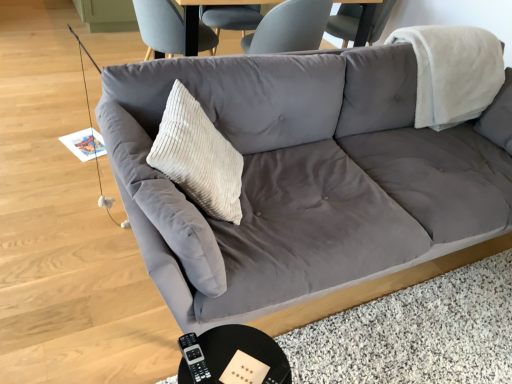
Question: Is suede gray couch at center oriented away from black glossy round table at lower center?

Choices:
 (A) yes
 (B) no

Answer: (B)

Question: Is black glossy round table at lower center surrounded by suede gray couch at center?

Choices:
 (A) yes
 (B) no

Answer: (B)

Question: Is suede gray couch at center not near black glossy round table at lower center?

Choices:
 (A) yes
 (B) no

Answer: (B)

Question: From the image's perspective, is suede gray couch at center above black glossy round table at lower center?

Choices:
 (A) no
 (B) yes

Answer: (B)

Question: From a real-world perspective, is suede gray couch at center on top of black glossy round table at lower center?

Choices:
 (A) no
 (B) yes

Answer: (B)

Question: In terms of size, does suede gray couch at center appear bigger or smaller than black glossy round table at lower center?

Choices:
 (A) small
 (B) big

Answer: (B)

Question: From the image's perspective, is suede gray couch at center above or below black glossy round table at lower center?

Choices:
 (A) below
 (B) above

Answer: (B)

Question: In terms of width, does suede gray couch at center look wider or thinner when compared to black glossy round table at lower center?

Choices:
 (A) thin
 (B) wide

Answer: (B)

Question: From a real-world perspective, relative to black glossy round table at lower center, is suede gray couch at center vertically above or below?

Choices:
 (A) below
 (B) above

Answer: (B)

Question: Looking at their shapes, would you say black glossy round table at lower center is wider or thinner than beige corduroy pillow at center?

Choices:
 (A) wide
 (B) thin

Answer: (A)

Question: From a real-world perspective, is black glossy round table at lower center positioned above or below beige corduroy pillow at center?

Choices:
 (A) below
 (B) above

Answer: (A)

Question: Does point (183, 336) appear closer or farther from the camera than point (186, 155)?

Choices:
 (A) closer
 (B) farther

Answer: (A)

Question: In terms of size, does black glossy round table at lower center appear bigger or smaller than beige corduroy pillow at center?

Choices:
 (A) small
 (B) big

Answer: (A)

Question: From their relative heights in the image, would you say black glossy round table at lower center is taller or shorter than suede gray couch at center?

Choices:
 (A) tall
 (B) short

Answer: (B)

Question: Is black glossy round table at lower center in front of or behind suede gray couch at center in the image?

Choices:
 (A) behind
 (B) front

Answer: (A)